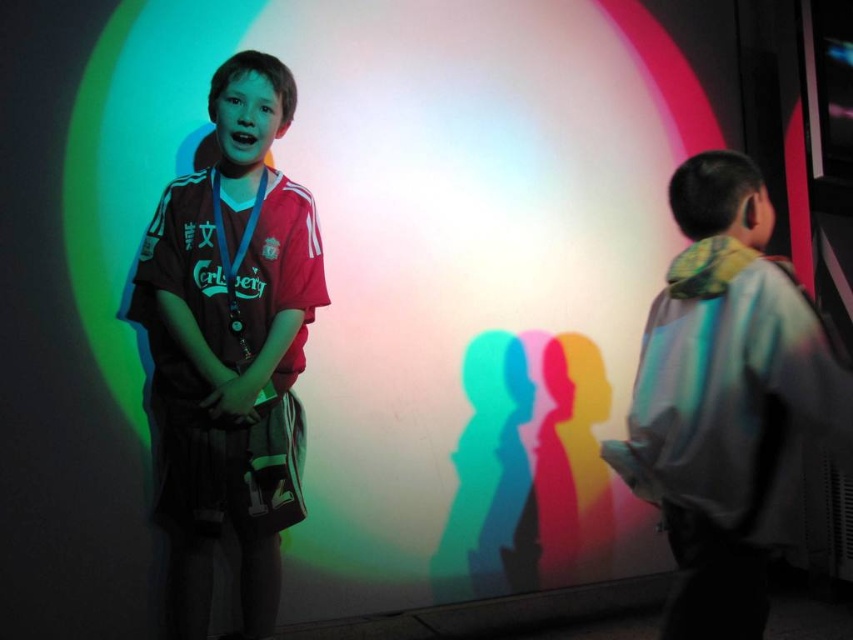
Question: Is matte red jersey at center wider than light blue fabric jacket at right?

Choices:
 (A) no
 (B) yes

Answer: (B)

Question: Which of the following is the farthest from the observer?

Choices:
 (A) (268, 612)
 (B) (663, 420)

Answer: (A)

Question: Observing the image, what is the correct spatial positioning of matte red jersey at center in reference to light blue fabric jacket at right?

Choices:
 (A) right
 (B) left

Answer: (B)

Question: Among these objects, which one is farthest from the camera?

Choices:
 (A) light blue fabric jacket at right
 (B) matte red jersey at center

Answer: (B)

Question: Can you confirm if matte red jersey at center is wider than light blue fabric jacket at right?

Choices:
 (A) yes
 (B) no

Answer: (A)